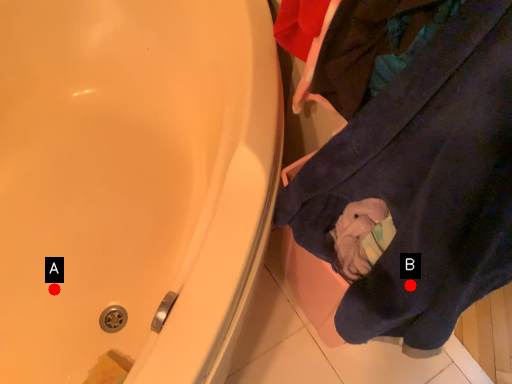
Question: Two points are circled on the image, labeled by A and B beside each circle. Which point is farther to the camera?

Choices:
 (A) A is further
 (B) B is further

Answer: (A)